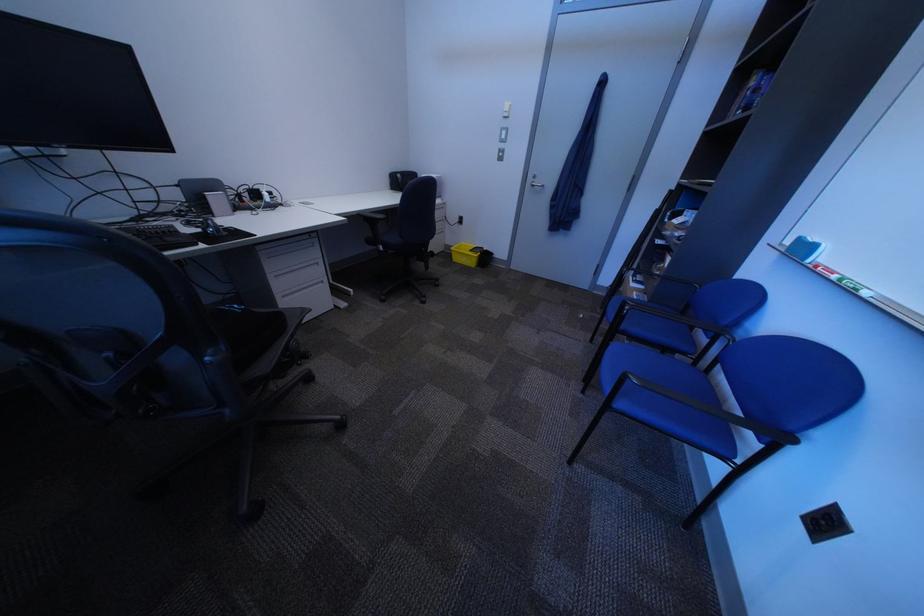
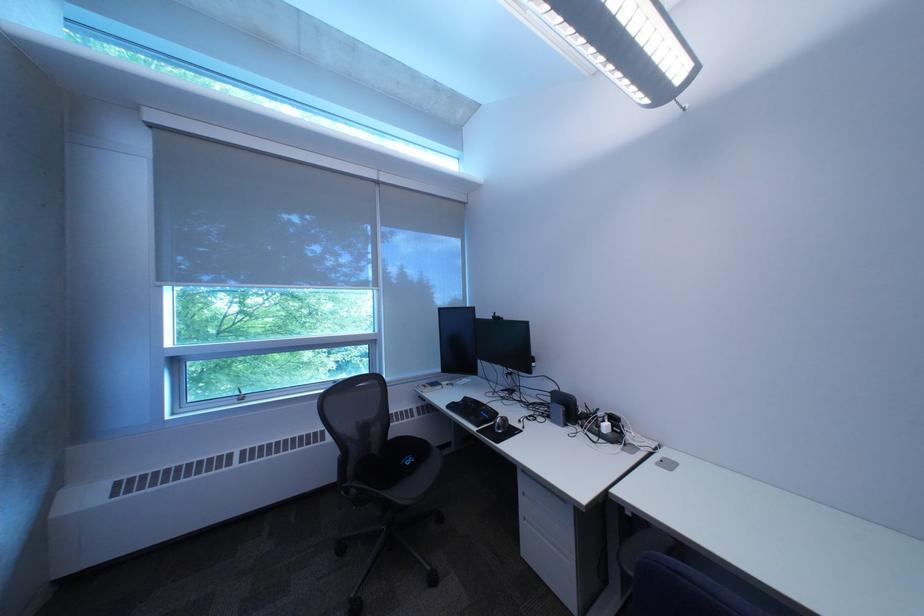
Locate, in the second image, the point that corresponds to (116,195) in the first image.

(532, 387)